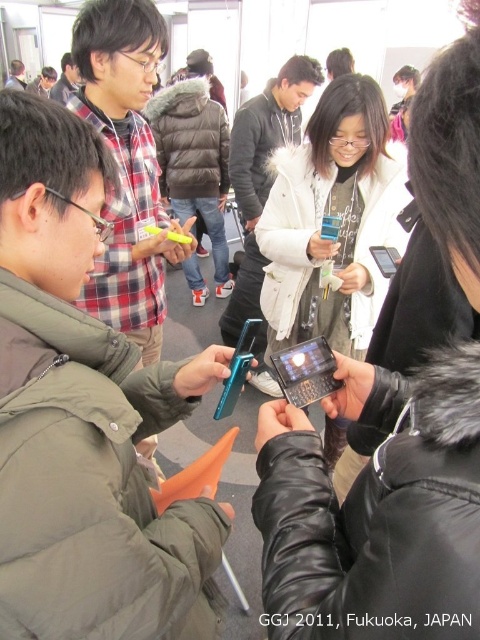
You are standing at point (23, 65) and want to walk to point (393, 262). Is the destination point in front of you or behind you?

The destination point (393, 262) is in front of point (23, 65), so the destination is in front of you.

You are standing in the middle of the convention center and see the point marked at coordinates (385, 259). What object is located at that point?

The sleek black phone at center is located at the point marked at coordinates (385, 259).